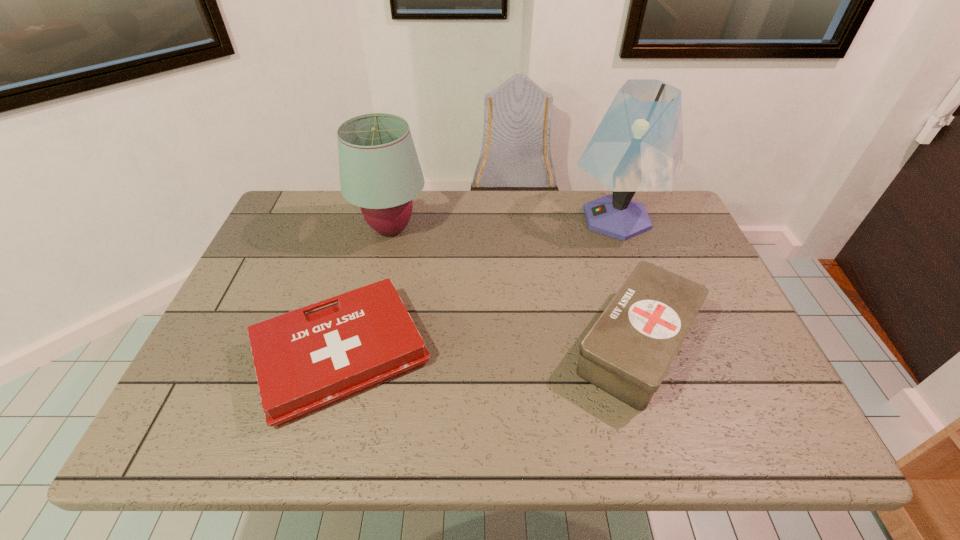
Where is `blank area located 0.080m on the base of the tallest object`? The width and height of the screenshot is (960, 540). blank area located 0.080m on the base of the tallest object is located at coordinates click(541, 219).

Locate an element on the screen. free space located 0.370m on the right of the shorter lampshade is located at coordinates (553, 229).

At what (x,y) coordinates should I click in order to perform the action: click on vacant space situated on the back of the third tallest object. Please return your answer as a coordinate pair (x, y). Looking at the image, I should click on (616, 276).

At what (x,y) coordinates should I click in order to perform the action: click on vacant area located 0.340m on the back of the shortest object. Please return your answer as a coordinate pair (x, y). This screenshot has width=960, height=540. Looking at the image, I should click on click(x=379, y=214).

You are a GUI agent. You are given a task and a screenshot of the screen. Output one action in this format:
    pyautogui.click(x=<x>, y=<y>)
    Task: Click on the object that is at the left edge
    Image resolution: width=960 pixels, height=540 pixels.
    Given the screenshot: What is the action you would take?
    pyautogui.click(x=304, y=362)

Find the location of a particular element. This screenshot has width=960, height=540. lampshade that is at the right edge is located at coordinates (638, 146).

I want to click on the first-aid kit that is positioned at the right edge, so click(628, 351).

Locate an element on the screen. object present at the near left corner is located at coordinates pyautogui.click(x=304, y=362).

Find the location of a particular element. This screenshot has width=960, height=540. object at the far right corner is located at coordinates (638, 146).

This screenshot has width=960, height=540. Find the location of `object positioned at the near right corner`. object positioned at the near right corner is located at coordinates (628, 351).